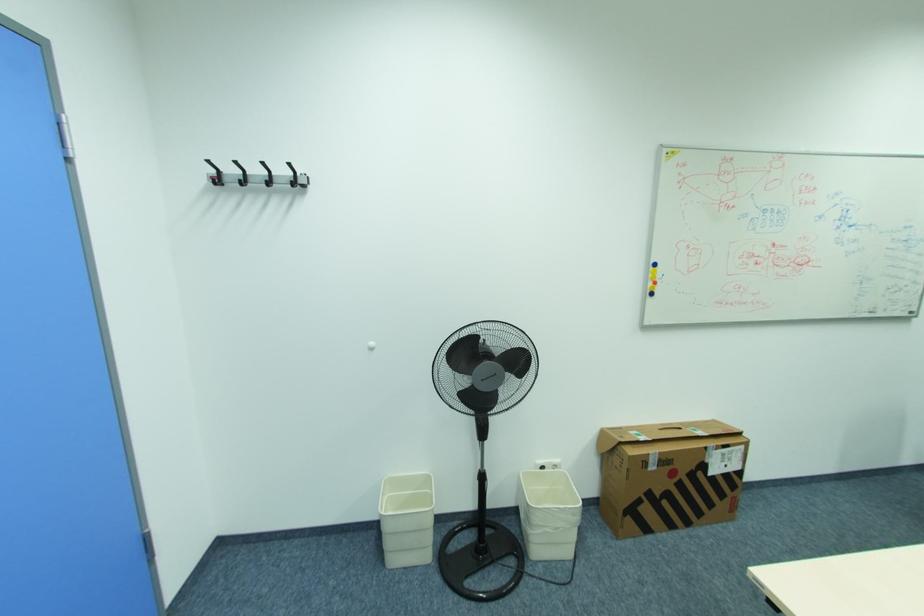
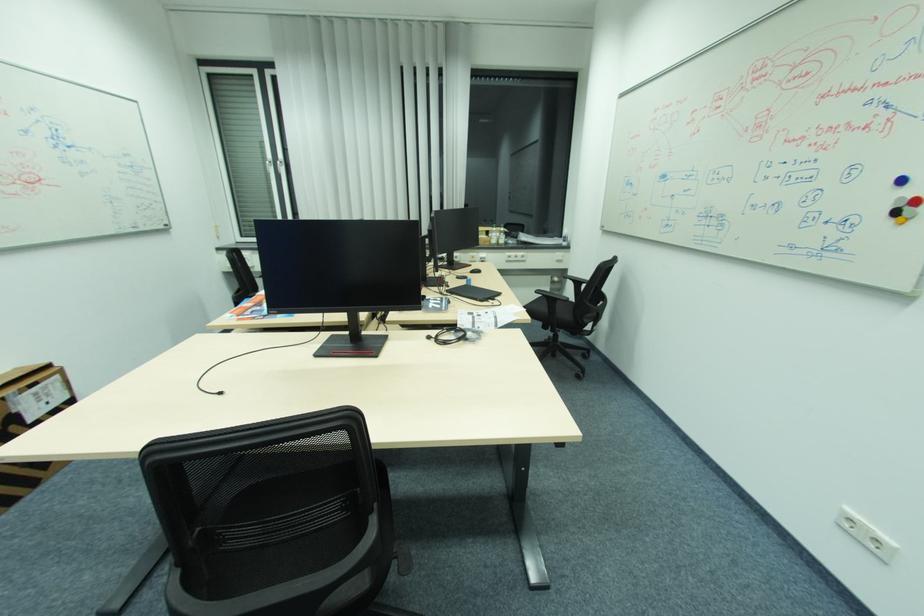
The images are taken continuously from a first-person perspective. In which direction is your viewpoint rotating?

The camera rotated toward right-down.